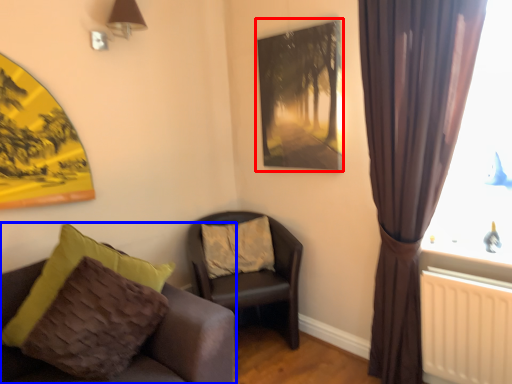
Question: Which object appears farthest to the camera in this image, picture frame (highlighted by a red box) or chair (highlighted by a blue box)?

Choices:
 (A) picture frame
 (B) chair

Answer: (A)